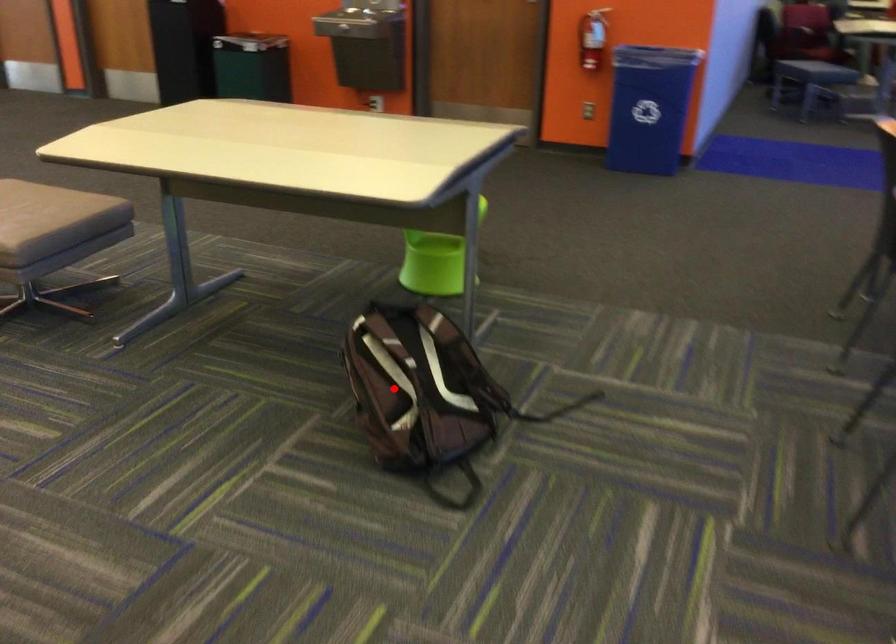
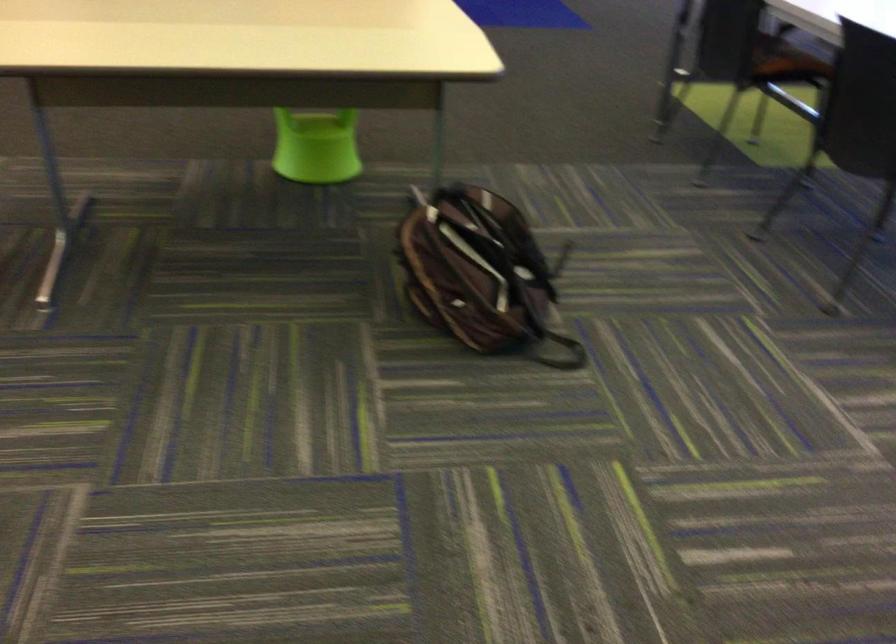
Where in the second image is the point corresponding to the highlighted location from the first image?

(479, 272)